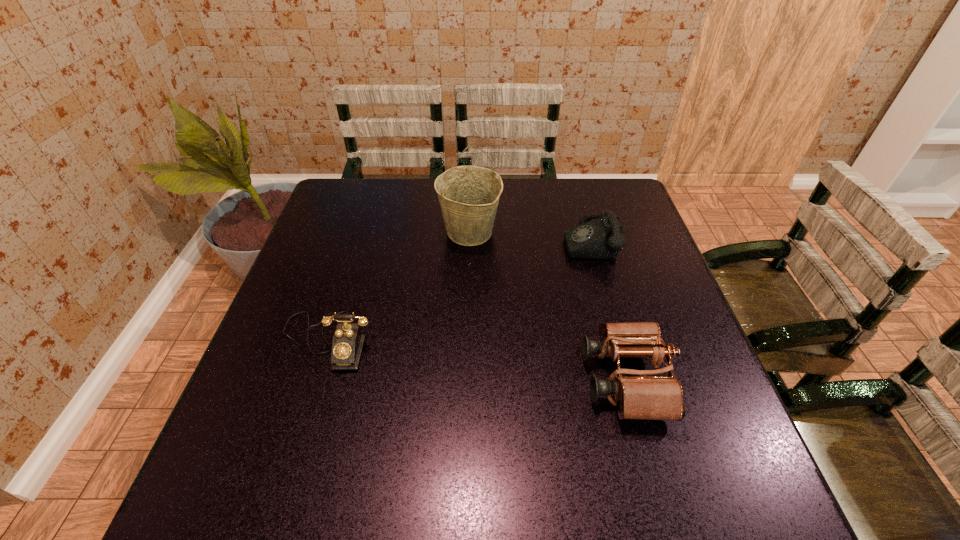
This screenshot has width=960, height=540. I want to click on empty space between the leftmost object and the farther telephone, so click(458, 291).

Where is `vacant point located between the binoculars and the farther telephone`? The image size is (960, 540). vacant point located between the binoculars and the farther telephone is located at coordinates (607, 310).

Locate an element on the screen. This screenshot has height=540, width=960. free point between the right telephone and the third object from right to left is located at coordinates (529, 237).

This screenshot has height=540, width=960. In order to click on vacant point located between the wine bucket and the binoculars in this screenshot , I will do `click(547, 306)`.

The width and height of the screenshot is (960, 540). In order to click on free space between the left telephone and the binoculars in this screenshot , I will do `click(476, 360)`.

Where is `object that can be found as the third closest to the binoculars`? object that can be found as the third closest to the binoculars is located at coordinates (347, 344).

Point out which object is positioned as the second nearest to the leftmost object. Please provide its 2D coordinates. Your answer should be formatted as a tuple, i.e. [(x, y)], where the tuple contains the x and y coordinates of a point satisfying the conditions above.

[(640, 394)]